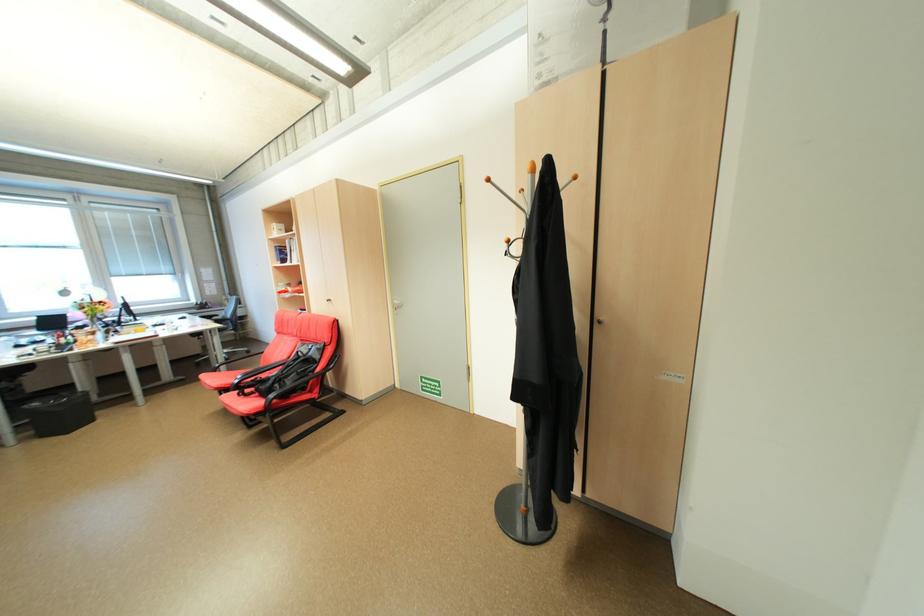
What are the coordinates of `silver door handle` in the screenshot? It's located at (395, 304).